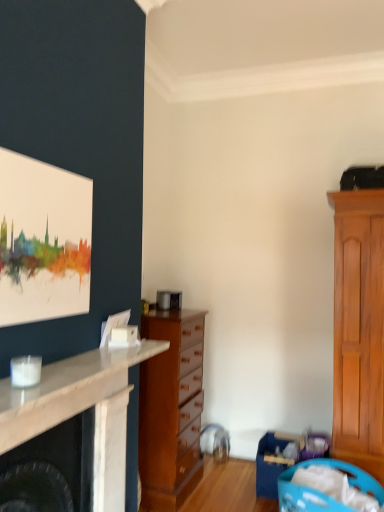
At what (x,y) coordinates should I click in order to perform the action: click on wooden chest of drawers at center. Please return your answer as a coordinate pair (x, y). The width and height of the screenshot is (384, 512). Looking at the image, I should click on (171, 408).

You are a GUI agent. You are given a task and a screenshot of the screen. Output one action in this format:
    pyautogui.click(x=<x>, y=<y>)
    Task: Click on the blue plastic laundry basket at lower right, the second laundry basket when ordered from front to back
    
    Given the screenshot: What is the action you would take?
    pyautogui.click(x=270, y=463)

Measure the distance between blue plastic laundry basket at lower right, placed as the 1th laundry basket when sorted from front to back, and camera.

blue plastic laundry basket at lower right, placed as the 1th laundry basket when sorted from front to back, and camera are 2.22 meters apart.

At what (x,y) coordinates should I click in order to perform the action: click on blue plastic laundry basket at lower right, placed as the 1th laundry basket when sorted from front to back. Please return your answer as a coordinate pair (x, y). The image size is (384, 512). Looking at the image, I should click on (322, 492).

You are a GUI agent. You are given a task and a screenshot of the screen. Output one action in this format:
    pyautogui.click(x=<x>, y=<y>)
    Task: Click on the wooden chest of drawers at center
    The image size is (384, 512).
    Given the screenshot: What is the action you would take?
    point(171,408)

Is blue plastic laundry basket at lower right, the second laundry basket when ordered from front to back, at the back of white marble fireplace at left?

No, blue plastic laundry basket at lower right, the second laundry basket when ordered from front to back, is not at the back of white marble fireplace at left.

Between white marble fireplace at left and blue plastic laundry basket at lower right, the first laundry basket when ordered from back to front, which one appears on the right side from the viewer's perspective?

From the viewer's perspective, blue plastic laundry basket at lower right, the first laundry basket when ordered from back to front, appears more on the right side.

Who is bigger, white marble fireplace at left or blue plastic laundry basket at lower right, the second laundry basket when ordered from front to back?

Bigger between the two is blue plastic laundry basket at lower right, the second laundry basket when ordered from front to back.

Considering the sizes of objects white marble fireplace at left and blue plastic laundry basket at lower right, the second laundry basket when ordered from front to back, in the image provided, who is taller, white marble fireplace at left or blue plastic laundry basket at lower right, the second laundry basket when ordered from front to back,?

Standing taller between the two is blue plastic laundry basket at lower right, the second laundry basket when ordered from front to back.

From the picture: Is blue plastic laundry basket at lower right, placed as the 1th laundry basket when sorted from front to back, surrounding watercolor canvas at upper left?

No, blue plastic laundry basket at lower right, placed as the 1th laundry basket when sorted from front to back, does not contain watercolor canvas at upper left.

From the image's perspective, which one is positioned lower, blue plastic laundry basket at lower right, placed as the 1th laundry basket when sorted from front to back, or watercolor canvas at upper left?

blue plastic laundry basket at lower right, placed as the 1th laundry basket when sorted from front to back.

Can you confirm if blue plastic laundry basket at lower right, the second laundry basket when ordered from back to front, is positioned to the right of watercolor canvas at upper left?

Yes, blue plastic laundry basket at lower right, the second laundry basket when ordered from back to front, is to the right of watercolor canvas at upper left.

Could you tell me if blue plastic laundry basket at lower right, the second laundry basket when ordered from back to front, is facing watercolor canvas at upper left?

No, blue plastic laundry basket at lower right, the second laundry basket when ordered from back to front, is not aimed at watercolor canvas at upper left.

Is blue plastic laundry basket at lower right, the first laundry basket when ordered from back to front, closer to the viewer compared to wooden chest of drawers at center?

No, blue plastic laundry basket at lower right, the first laundry basket when ordered from back to front, is further to the viewer.

Could you tell me if blue plastic laundry basket at lower right, the second laundry basket when ordered from front to back, is facing wooden chest of drawers at center?

No.

Is point (266, 483) behind point (172, 411)?

Yes, it is behind point (172, 411).

Who is smaller, blue plastic laundry basket at lower right, the second laundry basket when ordered from front to back, or wooden chest of drawers at center?

Smaller between the two is blue plastic laundry basket at lower right, the second laundry basket when ordered from front to back.

The width and height of the screenshot is (384, 512). Identify the location of picture frame behind the white marble fireplace at left. (43, 240).

From the image's perspective, would you say white marble fireplace at left is shown under watercolor canvas at upper left?

Yes.

From a real-world perspective, which is physically below, white marble fireplace at left or watercolor canvas at upper left?

white marble fireplace at left is physically lower.

Is blue plastic laundry basket at lower right, placed as the 1th laundry basket when sorted from front to back, at the right side of white marble fireplace at left?

Yes.

From a real-world perspective, is blue plastic laundry basket at lower right, placed as the 1th laundry basket when sorted from front to back, physically below white marble fireplace at left?

Yes, from a real-world perspective, blue plastic laundry basket at lower right, placed as the 1th laundry basket when sorted from front to back, is under white marble fireplace at left.

Is blue plastic laundry basket at lower right, placed as the 1th laundry basket when sorted from front to back, far away from white marble fireplace at left?

blue plastic laundry basket at lower right, placed as the 1th laundry basket when sorted from front to back, is far away from white marble fireplace at left.

Could you tell me if blue plastic laundry basket at lower right, the second laundry basket when ordered from back to front, is turned towards blue plastic laundry basket at lower right, the first laundry basket when ordered from back to front?

No, blue plastic laundry basket at lower right, the second laundry basket when ordered from back to front, does not turn towards blue plastic laundry basket at lower right, the first laundry basket when ordered from back to front.

From a real-world perspective, is blue plastic laundry basket at lower right, the second laundry basket when ordered from back to front, positioned above or below blue plastic laundry basket at lower right, the first laundry basket when ordered from back to front?

Clearly, from a real-world perspective, blue plastic laundry basket at lower right, the second laundry basket when ordered from back to front, is below blue plastic laundry basket at lower right, the first laundry basket when ordered from back to front.

Is point (303, 496) behind point (275, 438)?

No, it is in front of (275, 438).

Consider the image. Which object is more forward, blue plastic laundry basket at lower right, the second laundry basket when ordered from back to front, or blue plastic laundry basket at lower right, the second laundry basket when ordered from front to back?

blue plastic laundry basket at lower right, the second laundry basket when ordered from back to front, is closer to the camera.

Does wooden chest of drawers at center turn towards blue plastic laundry basket at lower right, the second laundry basket when ordered from back to front?

Yes, wooden chest of drawers at center faces towards blue plastic laundry basket at lower right, the second laundry basket when ordered from back to front.

Is blue plastic laundry basket at lower right, placed as the 1th laundry basket when sorted from front to back, located within wooden chest of drawers at center?

No, blue plastic laundry basket at lower right, placed as the 1th laundry basket when sorted from front to back, is not surrounded by wooden chest of drawers at center.

How many degrees apart are the facing directions of wooden chest of drawers at center and blue plastic laundry basket at lower right, the second laundry basket when ordered from back to front?

37.4 degrees separate the facing orientations of wooden chest of drawers at center and blue plastic laundry basket at lower right, the second laundry basket when ordered from back to front.

From a real-world perspective, count 1st laundry baskets downward from the white marble fireplace at left and point to it. Please provide its 2D coordinates.

[(270, 463)]

The height and width of the screenshot is (512, 384). What are the coordinates of `picture frame above the blue plastic laundry basket at lower right, the second laundry basket when ordered from back to front (from the image's perspective)` in the screenshot? It's located at (43, 240).

Considering their positions, is blue plastic laundry basket at lower right, the second laundry basket when ordered from back to front, positioned further to white marble fireplace at left than blue plastic laundry basket at lower right, the second laundry basket when ordered from front to back?

Based on the image, blue plastic laundry basket at lower right, the second laundry basket when ordered from front to back, appears to be further to white marble fireplace at left.

Which object lies nearer to the anchor point watercolor canvas at upper left, wooden chest of drawers at center or blue plastic laundry basket at lower right, the first laundry basket when ordered from back to front?

Among the two, wooden chest of drawers at center is located nearer to watercolor canvas at upper left.

Based on their spatial positions, is white marble fireplace at left or watercolor canvas at upper left closer to blue plastic laundry basket at lower right, placed as the 1th laundry basket when sorted from front to back?

Based on the image, white marble fireplace at left appears to be nearer to blue plastic laundry basket at lower right, placed as the 1th laundry basket when sorted from front to back.

From the image, which object appears to be farther from blue plastic laundry basket at lower right, the first laundry basket when ordered from back to front, watercolor canvas at upper left or blue plastic laundry basket at lower right, placed as the 1th laundry basket when sorted from front to back?

watercolor canvas at upper left.

Based on their spatial positions, is blue plastic laundry basket at lower right, the second laundry basket when ordered from front to back, or blue plastic laundry basket at lower right, the second laundry basket when ordered from back to front, further from watercolor canvas at upper left?

Among the two, blue plastic laundry basket at lower right, the second laundry basket when ordered from front to back, is located further to watercolor canvas at upper left.

Considering their positions, is blue plastic laundry basket at lower right, the second laundry basket when ordered from back to front, positioned closer to watercolor canvas at upper left than blue plastic laundry basket at lower right, the second laundry basket when ordered from front to back?

blue plastic laundry basket at lower right, the second laundry basket when ordered from back to front, lies closer to watercolor canvas at upper left than the other object.

Estimate the real-world distances between objects in this image. Which object is further from wooden chest of drawers at center, watercolor canvas at upper left or blue plastic laundry basket at lower right, the second laundry basket when ordered from front to back?

watercolor canvas at upper left is positioned further to the anchor wooden chest of drawers at center.

Estimate the real-world distances between objects in this image. Which object is closer to watercolor canvas at upper left, white marble fireplace at left or blue plastic laundry basket at lower right, the first laundry basket when ordered from back to front?

Among the two, white marble fireplace at left is located nearer to watercolor canvas at upper left.

Find the location of `picture frame located between white marble fireplace at left and blue plastic laundry basket at lower right, the first laundry basket when ordered from back to front, in the depth direction`. picture frame located between white marble fireplace at left and blue plastic laundry basket at lower right, the first laundry basket when ordered from back to front, in the depth direction is located at coordinates (43, 240).

The width and height of the screenshot is (384, 512). Identify the location of chest of drawers between watercolor canvas at upper left and blue plastic laundry basket at lower right, the first laundry basket when ordered from back to front, from top to bottom. (171, 408).

Where is `laundry basket located between white marble fireplace at left and blue plastic laundry basket at lower right, the second laundry basket when ordered from front to back, in the depth direction`? laundry basket located between white marble fireplace at left and blue plastic laundry basket at lower right, the second laundry basket when ordered from front to back, in the depth direction is located at coordinates (322, 492).

Locate an element on the screen. chest of drawers between white marble fireplace at left and blue plastic laundry basket at lower right, the first laundry basket when ordered from back to front, along the z-axis is located at coordinates (171, 408).